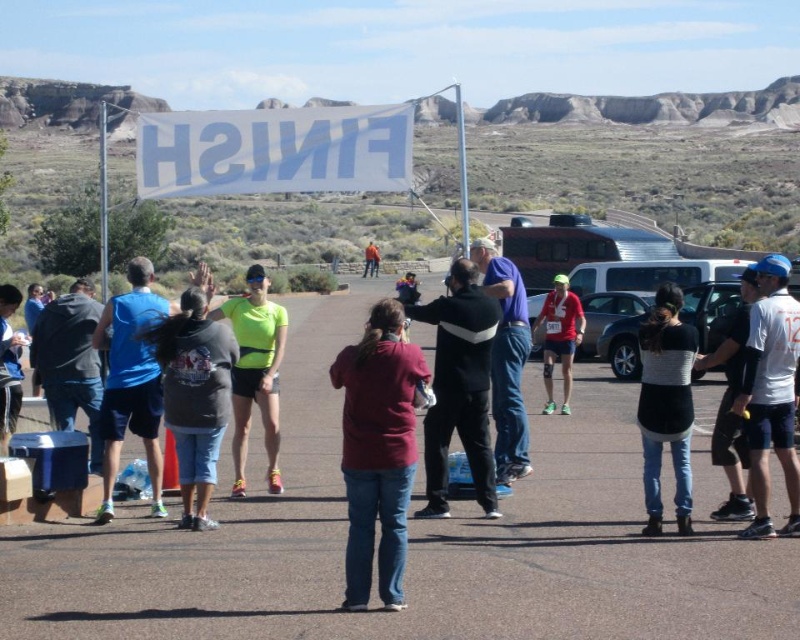
Question: Among these objects, which one is nearest to the camera?

Choices:
 (A) metallic silver car at center
 (B) black and white striped sweater at center
 (C) red fabric runner at center
 (D) neon yellow fabric at center

Answer: (B)

Question: From the image, what is the correct spatial relationship of black and white striped sweater at center in relation to matte gray hoodie at left?

Choices:
 (A) above
 (B) below

Answer: (A)

Question: Which point is farther from the camera taking this photo?

Choices:
 (A) (6, 328)
 (B) (582, 324)

Answer: (B)

Question: Observing the image, what is the correct spatial positioning of maroon fabric shirt at center in reference to neon yellow fabric at center?

Choices:
 (A) left
 (B) right

Answer: (B)

Question: Does neon yellow fabric at center have a smaller size compared to red fabric runner at center?

Choices:
 (A) no
 (B) yes

Answer: (A)

Question: Which object is closer to the camera taking this photo?

Choices:
 (A) red fabric runner at center
 (B) matte gray hoodie at left
 (C) metallic silver car at center
 (D) black and white striped sweater at center

Answer: (D)